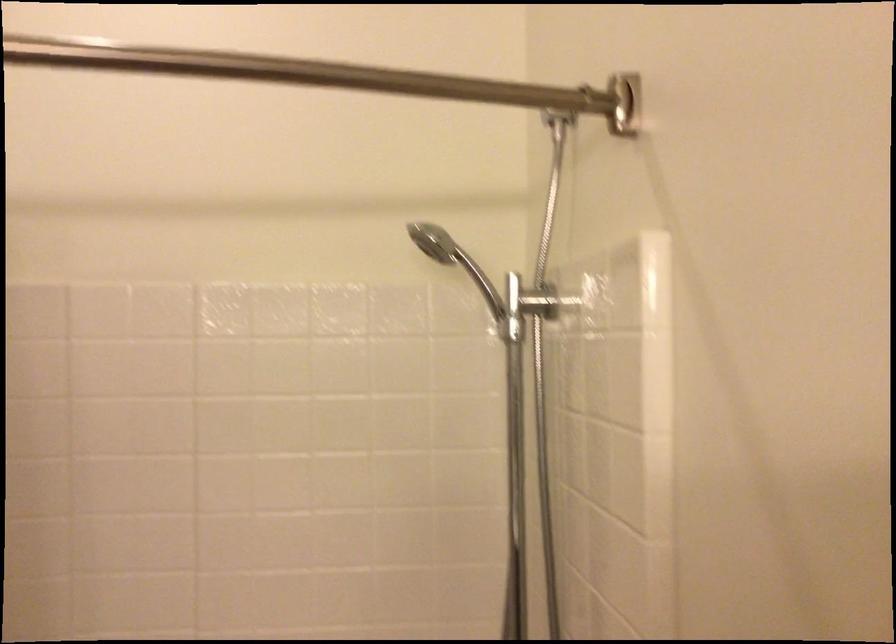
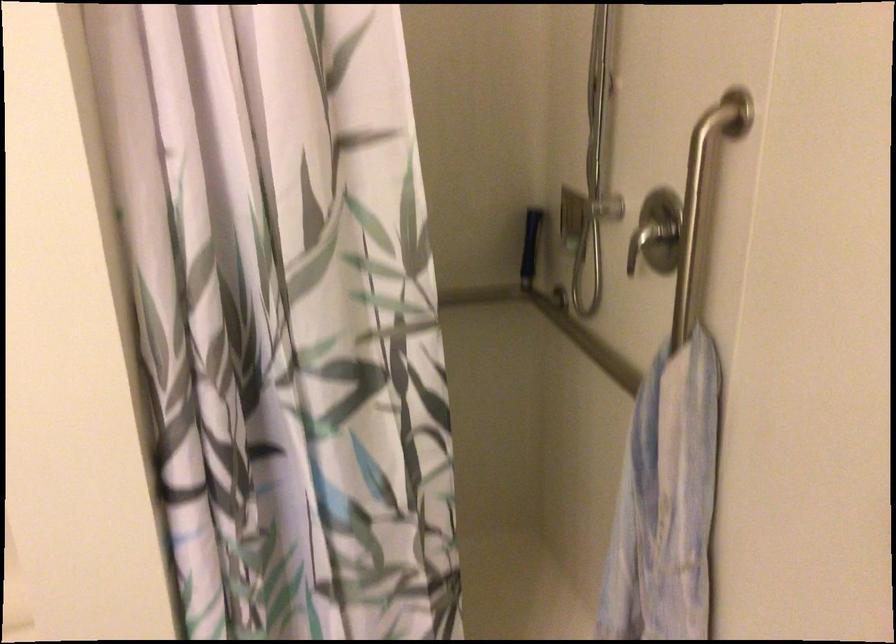
The images are taken continuously from a first-person perspective. In which direction are you moving?

The cameraman walked toward right, backward.